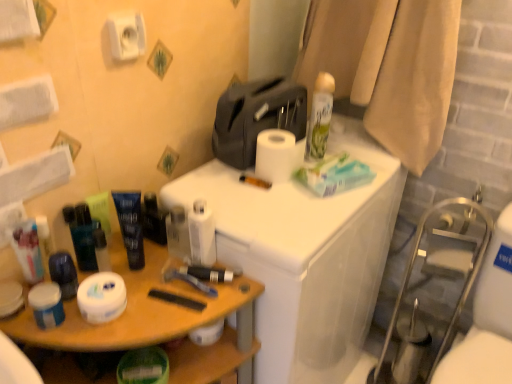
Question: Can you confirm if white matte jar at left, which appears as the first toiletry when viewed from the left, is positioned to the left of white matte toilet paper at lower left, the 4th toilet paper positioned from the top?

Choices:
 (A) no
 (B) yes

Answer: (B)

Question: Can you confirm if white matte jar at left, positioned as the fifth toiletry in right-to-left order, is positioned to the right of white matte toilet paper at lower left, the 1th toilet paper positioned from the bottom?

Choices:
 (A) no
 (B) yes

Answer: (A)

Question: Is white matte jar at left, positioned as the fifth toiletry in right-to-left order, positioned before white matte toilet paper at lower left, the 1th toilet paper positioned from the bottom?

Choices:
 (A) no
 (B) yes

Answer: (A)

Question: Is white matte jar at left, positioned as the fifth toiletry in right-to-left order, oriented away from white matte toilet paper at lower left, which is counted as the fourth toilet paper, starting from the right?

Choices:
 (A) no
 (B) yes

Answer: (A)

Question: Can you confirm if white matte jar at left, positioned as the fifth toiletry in right-to-left order, is wider than white matte toilet paper at lower left, the 4th toilet paper positioned from the top?

Choices:
 (A) yes
 (B) no

Answer: (B)

Question: Would you say matte green tube at left, arranged as the third toiletry when viewed from the left, is to the left or to the right of matte black tube at center, arranged as the first toiletry when viewed from the right, in the picture?

Choices:
 (A) right
 (B) left

Answer: (B)

Question: Is matte green tube at left, arranged as the 3th toiletry when viewed from the right, situated inside matte black tube at center, which is counted as the fifth toiletry, starting from the left, or outside?

Choices:
 (A) inside
 (B) outside

Answer: (B)

Question: From a real-world perspective, relative to matte black tube at center, arranged as the first toiletry when viewed from the right, is matte green tube at left, arranged as the 3th toiletry when viewed from the right, vertically above or below?

Choices:
 (A) above
 (B) below

Answer: (A)

Question: Is matte green tube at left, arranged as the third toiletry when viewed from the left, bigger or smaller than matte black tube at center, which is counted as the fifth toiletry, starting from the left?

Choices:
 (A) small
 (B) big

Answer: (A)

Question: Is woodenmaterial/texturecounter at left, the 1th counter viewed from the left, in front of or behind matte black tube at center, arranged as the first toiletry when viewed from the right, in the image?

Choices:
 (A) behind
 (B) front

Answer: (B)

Question: Does point (110, 332) appear closer or farther from the camera than point (157, 206)?

Choices:
 (A) farther
 (B) closer

Answer: (B)

Question: Considering the relative positions of woodenmaterial/texturecounter at left, the 2th counter from the right, and matte black tube at center, arranged as the first toiletry when viewed from the right, in the image provided, is woodenmaterial/texturecounter at left, the 2th counter from the right, to the left or to the right of matte black tube at center, arranged as the first toiletry when viewed from the right,?

Choices:
 (A) left
 (B) right

Answer: (A)

Question: Considering the positions of woodenmaterial/texturecounter at left, the 2th counter from the right, and matte black tube at center, arranged as the first toiletry when viewed from the right, in the image, is woodenmaterial/texturecounter at left, the 2th counter from the right, taller or shorter than matte black tube at center, arranged as the first toiletry when viewed from the right,?

Choices:
 (A) short
 (B) tall

Answer: (B)

Question: Looking at the image, does white matte toilet paper at lower left, which is counted as the fourth toilet paper, starting from the right, seem bigger or smaller compared to matte black tube at center, arranged as the first toiletry when viewed from the right?

Choices:
 (A) small
 (B) big

Answer: (B)

Question: From the image's perspective, is white matte toilet paper at lower left, the 4th toilet paper positioned from the top, positioned above or below matte black tube at center, arranged as the first toiletry when viewed from the right?

Choices:
 (A) above
 (B) below

Answer: (B)